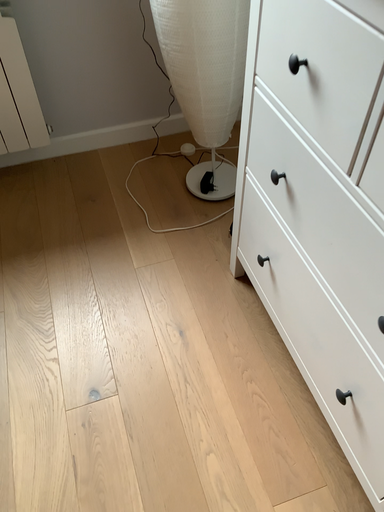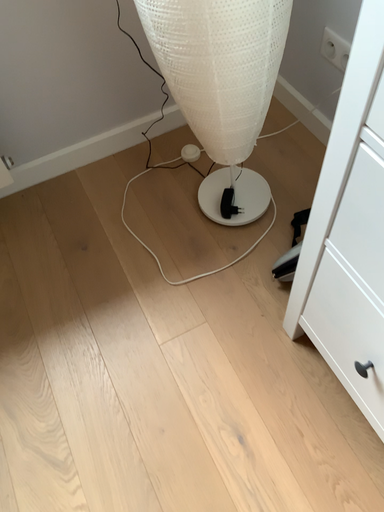
Question: Which way did the camera rotate in the video?

Choices:
 (A) rotated downward
 (B) rotated upward

Answer: (A)